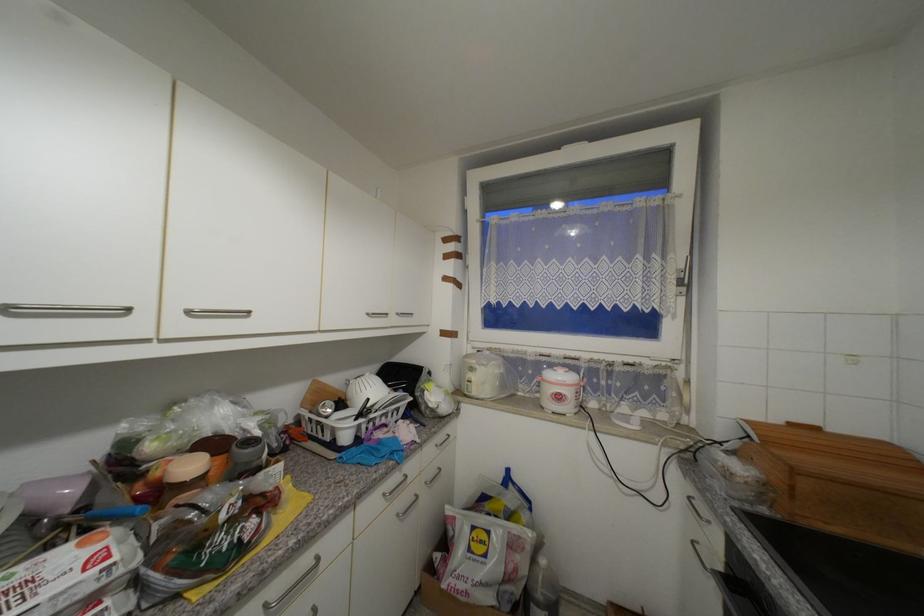
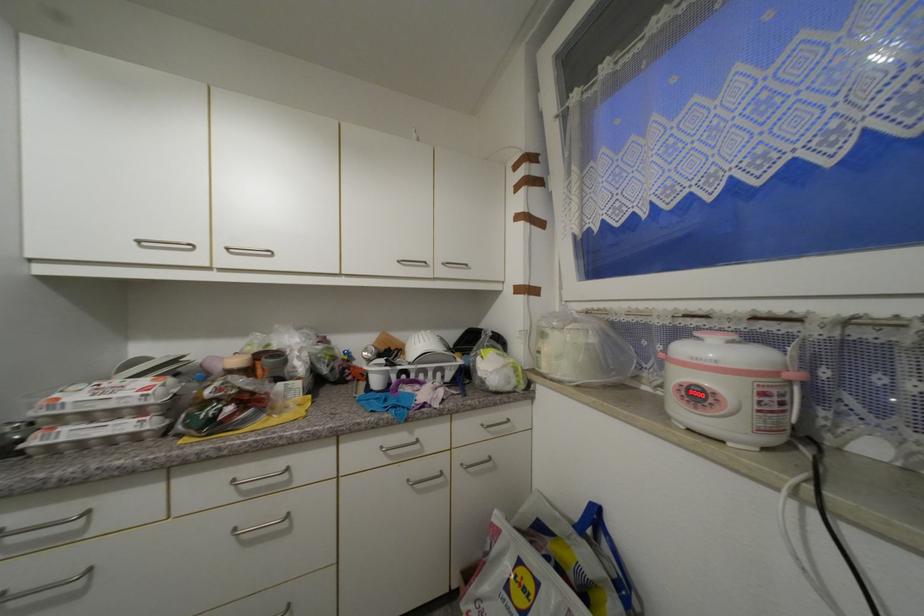
The point at (x=588, y=385) is marked in the first image. Where is the corresponding point in the second image?

(799, 378)